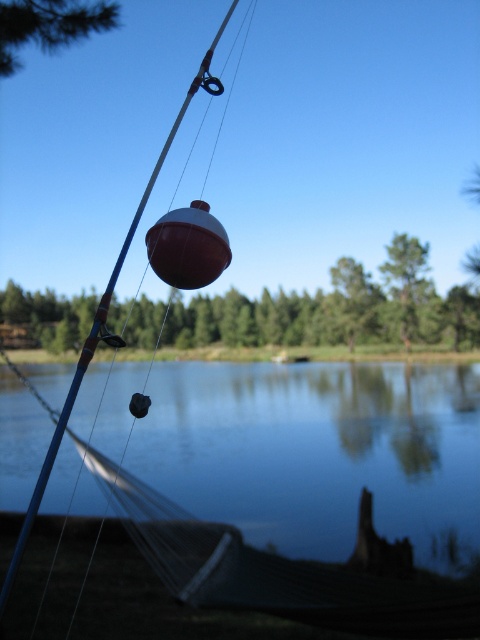
You are an observer standing at the lakeside. You see the matte blue fishing pole at center and the green matte tree at upper center. Which object is positioned higher in the image?

The matte blue fishing pole at center is located above the green matte tree at upper center, so it is positioned higher in the image.

You are standing at the lakeside and want to know which of the two points, point (456, 401) or point (12, 556), is closer to you. Can you determine this based on the scene?

Point (456, 401) is further to the viewer than point (12, 556), so the closer point to you is point (12, 556).